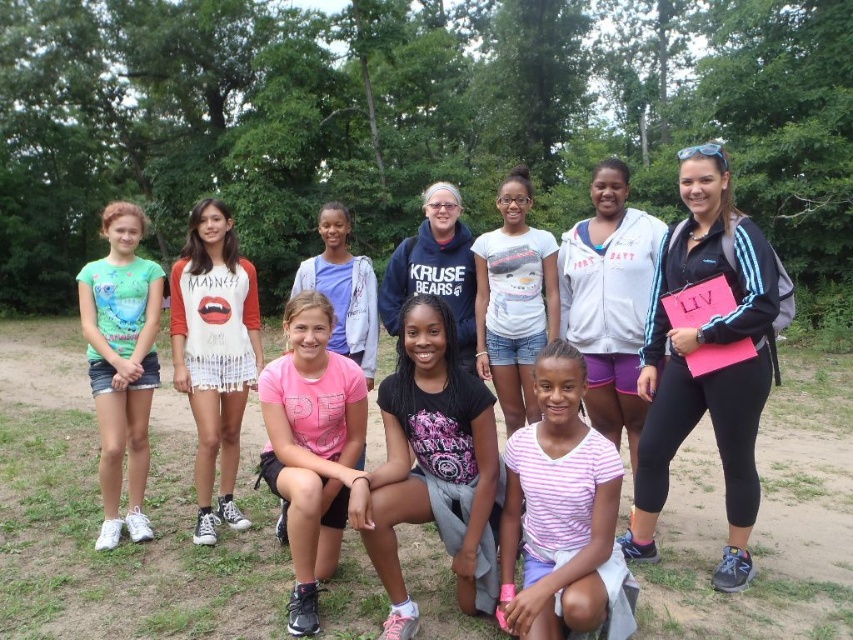
Question: Among these objects, which one is farthest from the camera?

Choices:
 (A) pink matte t-shirt at center
 (B) green matte t-shirt at left

Answer: (B)

Question: Does white fringed shirt at center appear on the left side of matte blue hoodie at center?

Choices:
 (A) no
 (B) yes

Answer: (B)

Question: Does pink striped shirt at lower center have a lesser width compared to pink matte t-shirt at center?

Choices:
 (A) no
 (B) yes

Answer: (B)

Question: Which of the following is the farthest from the observer?

Choices:
 (A) (212, 205)
 (B) (469, 298)
 (C) (99, 348)
 (D) (527, 426)

Answer: (B)

Question: Is white cotton t-shirt at center to the left of matte blue hoodie at center from the viewer's perspective?

Choices:
 (A) no
 (B) yes

Answer: (A)

Question: Which point is farther to the camera?

Choices:
 (A) (560, 636)
 (B) (351, 365)
 (C) (231, 404)
 (D) (523, 401)

Answer: (D)